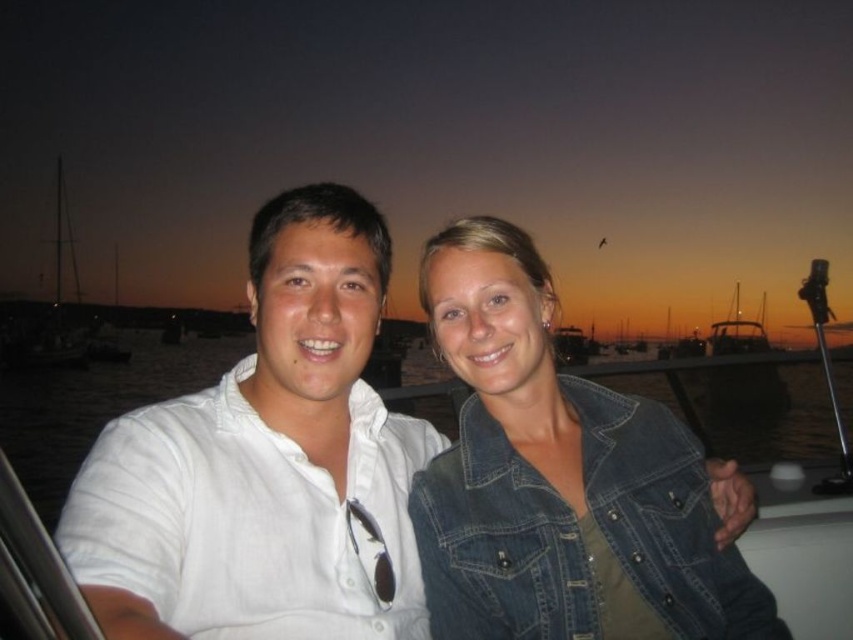
What do you see at coordinates (265, 464) in the screenshot?
I see `white cotton shirt at center` at bounding box center [265, 464].

Is white cotton shirt at center smaller than white matte water at center?

Correct, white cotton shirt at center occupies less space than white matte water at center.

Locate an element on the screen. The height and width of the screenshot is (640, 853). white cotton shirt at center is located at coordinates (265, 464).

In order to click on white cotton shirt at center in this screenshot , I will do pyautogui.click(x=265, y=464).

Does denim jacket at center lie behind white matte water at center?

That is False.

In the scene shown: Is denim jacket at center to the left of white matte water at center from the viewer's perspective?

No, denim jacket at center is not to the left of white matte water at center.

Is point (589, 452) positioned after point (41, 467)?

No, it is in front of (41, 467).

Image resolution: width=853 pixels, height=640 pixels. I want to click on denim jacket at center, so click(560, 480).

Is white cotton shirt at center thinner than denim jacket at center?

Indeed, white cotton shirt at center has a lesser width compared to denim jacket at center.

Which is more to the right, white cotton shirt at center or denim jacket at center?

From the viewer's perspective, denim jacket at center appears more on the right side.

Between point (334, 536) and point (610, 428), which one is positioned in front?

Point (334, 536)

Where is `white cotton shirt at center`? white cotton shirt at center is located at coordinates click(x=265, y=464).